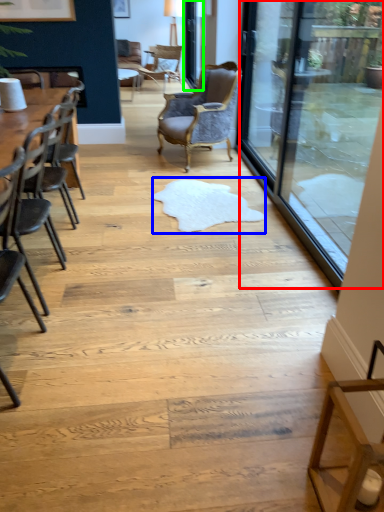
Question: Which is farther away from glass door (highlighted by a red box)? mat (highlighted by a blue box) or screen door (highlighted by a green box)?

Choices:
 (A) mat
 (B) screen door

Answer: (B)